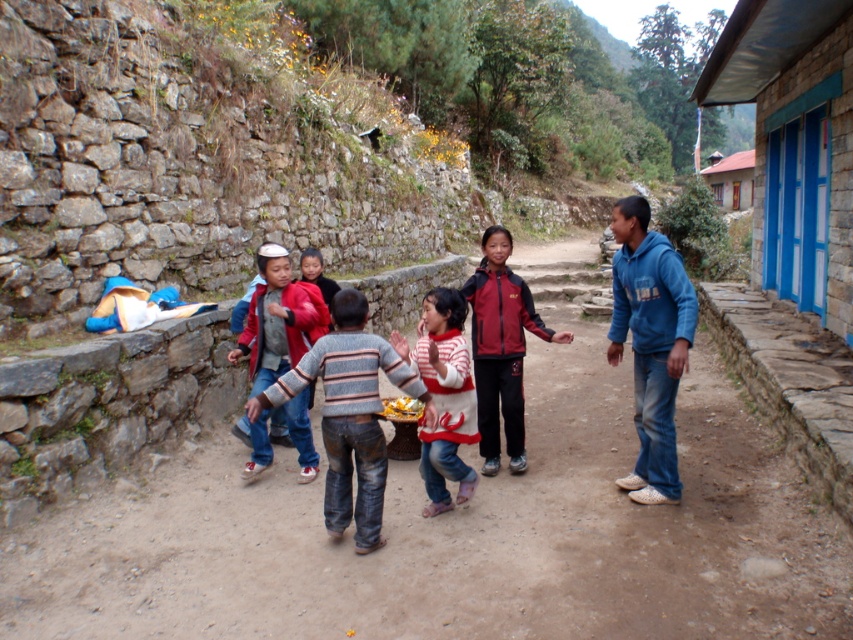
Does striped sweater at center have a smaller size compared to red jacket at center?

Yes, striped sweater at center is smaller than red jacket at center.

Between striped sweater at center and red jacket at center, which one appears on the left side from the viewer's perspective?

Positioned to the left is red jacket at center.

The image size is (853, 640). Describe the element at coordinates (349, 413) in the screenshot. I see `striped sweater at center` at that location.

The width and height of the screenshot is (853, 640). I want to click on striped sweater at center, so click(349, 413).

Describe the element at coordinates (459, 536) in the screenshot. This screenshot has width=853, height=640. I see `brown dirt track at center` at that location.

Is brown dirt track at center smaller than striped sweater at center?

Yes, brown dirt track at center is smaller than striped sweater at center.

Is point (502, 506) positioned after point (383, 356)?

Yes.

At what (x,y) coordinates should I click in order to perform the action: click on brown dirt track at center. Please return your answer as a coordinate pair (x, y). This screenshot has width=853, height=640. Looking at the image, I should click on pyautogui.click(x=459, y=536).

Which of these two, red jacket at center or brown wooden hut at upper right, stands taller?

With more height is brown wooden hut at upper right.

Identify the location of red jacket at center. The width and height of the screenshot is (853, 640). (274, 321).